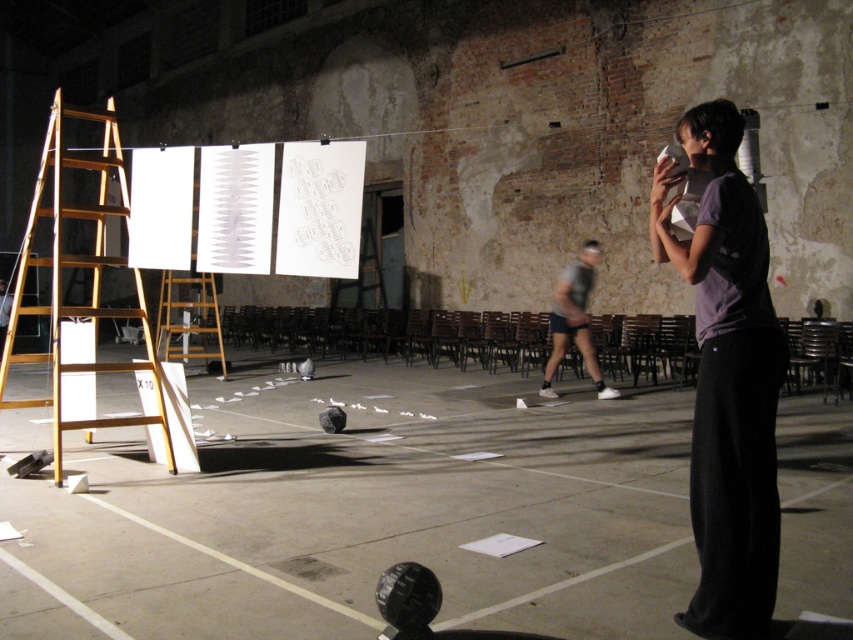
You are standing in the hall and see the wooden ladder leaning against the wall. Where is the wooden ladder located relative to the point at coordinates [79,276]?

The wooden ladder is located at the left side of the hall, as indicated by the point at coordinates [79,276].

You are an event organizer setting up for a presentation in the hall. You need to place a large banner on the wall where the wooden ladder at center is leaning. However, there are gray fabric shorts at center in the way. Can you move the shorts to the side to access the ladder?

The wooden ladder at center is located above gray fabric shorts at center, so you can move the gray fabric shorts at center to the side to access the ladder.

You are an interior designer planning to hang a new artwork between the wooden at left and the gray fabric shorts at center. Considering their heights, which object should the artwork be placed closer to?

The wooden at left is taller than the gray fabric shorts at center, so the artwork should be placed closer to the wooden at left to maintain visual balance.